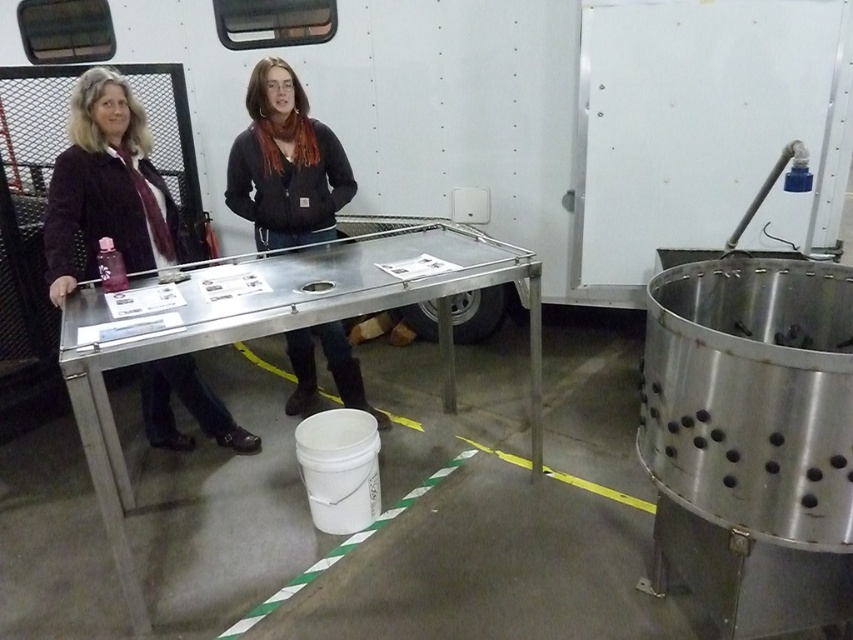
Can you confirm if matte black jacket at left is positioned to the right of matte black jacket at center?

No, matte black jacket at left is not to the right of matte black jacket at center.

Describe the element at coordinates (107, 186) in the screenshot. The height and width of the screenshot is (640, 853). I see `matte black jacket at left` at that location.

The height and width of the screenshot is (640, 853). In order to click on matte black jacket at left in this screenshot , I will do `click(107, 186)`.